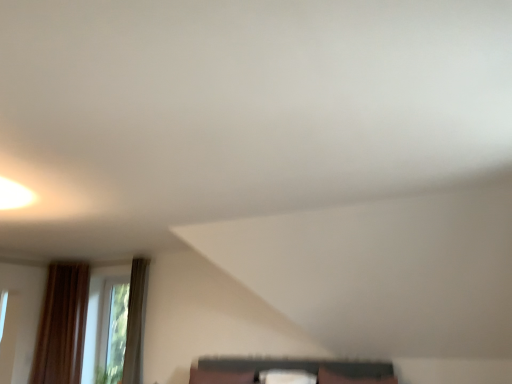
Question: From the image's perspective, is matte black shelf at lower center above transparent glass window at lower left?

Choices:
 (A) yes
 (B) no

Answer: (A)

Question: Is matte black shelf at lower center positioned in front of transparent glass window at lower left?

Choices:
 (A) yes
 (B) no

Answer: (A)

Question: Considering the relative positions of matte black shelf at lower center and transparent glass window at lower left in the image provided, is matte black shelf at lower center to the left of transparent glass window at lower left from the viewer's perspective?

Choices:
 (A) no
 (B) yes

Answer: (A)

Question: Considering the relative sizes of matte black shelf at lower center and transparent glass window at lower left in the image provided, is matte black shelf at lower center shorter than transparent glass window at lower left?

Choices:
 (A) yes
 (B) no

Answer: (A)

Question: Is matte black shelf at lower center positioned with its back to transparent glass window at lower left?

Choices:
 (A) no
 (B) yes

Answer: (A)

Question: Would you consider matte black shelf at lower center to be distant from transparent glass window at lower left?

Choices:
 (A) yes
 (B) no

Answer: (A)

Question: Does matte black shelf at lower center have a lesser height compared to brown fabric pillow at lower center, which ranks as the 1th pillow in left-to-right order?

Choices:
 (A) no
 (B) yes

Answer: (B)

Question: Is matte black shelf at lower center beside brown fabric pillow at lower center, acting as the 2th pillow starting from the right?

Choices:
 (A) no
 (B) yes

Answer: (A)

Question: Is matte black shelf at lower center oriented away from brown fabric pillow at lower center, acting as the 2th pillow starting from the right?

Choices:
 (A) no
 (B) yes

Answer: (A)

Question: Is brown fabric pillow at lower center, acting as the 2th pillow starting from the right, inside matte black shelf at lower center?

Choices:
 (A) yes
 (B) no

Answer: (B)

Question: Does matte black shelf at lower center have a smaller size compared to brown fabric pillow at lower center, which ranks as the 1th pillow in left-to-right order?

Choices:
 (A) no
 (B) yes

Answer: (B)

Question: Can you confirm if matte black shelf at lower center is taller than brown fabric pillow at lower center, which ranks as the 1th pillow in left-to-right order?

Choices:
 (A) yes
 (B) no

Answer: (B)

Question: From a real-world perspective, is white fabric pillow at center, the 1th pillow in the right-to-left sequence, positioned over matte black shelf at lower center based on gravity?

Choices:
 (A) no
 (B) yes

Answer: (A)